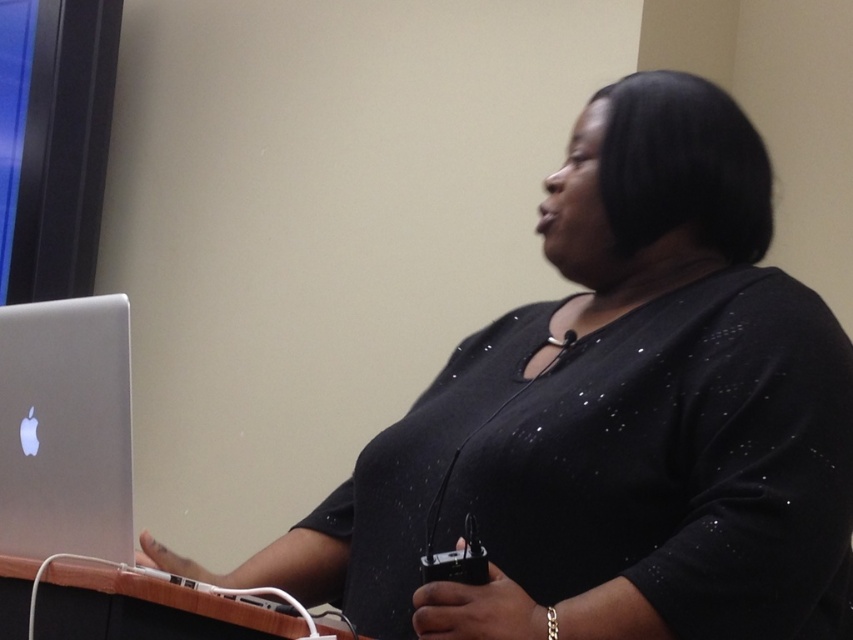
Question: Which object is farther from the camera taking this photo?

Choices:
 (A) silver metallic laptop at left
 (B) wooden table at lower left

Answer: (A)

Question: Does silver metallic laptop at left appear on the left side of wooden table at lower left?

Choices:
 (A) yes
 (B) no

Answer: (A)

Question: Can you confirm if silver metallic laptop at left is positioned above wooden table at lower left?

Choices:
 (A) no
 (B) yes

Answer: (B)

Question: Does silver metallic laptop at left appear on the left side of wooden table at lower left?

Choices:
 (A) no
 (B) yes

Answer: (B)

Question: Which point appears closest to the camera in this image?

Choices:
 (A) (134, 598)
 (B) (119, 314)

Answer: (A)

Question: Among these points, which one is nearest to the camera?

Choices:
 (A) (125, 532)
 (B) (22, 586)

Answer: (B)